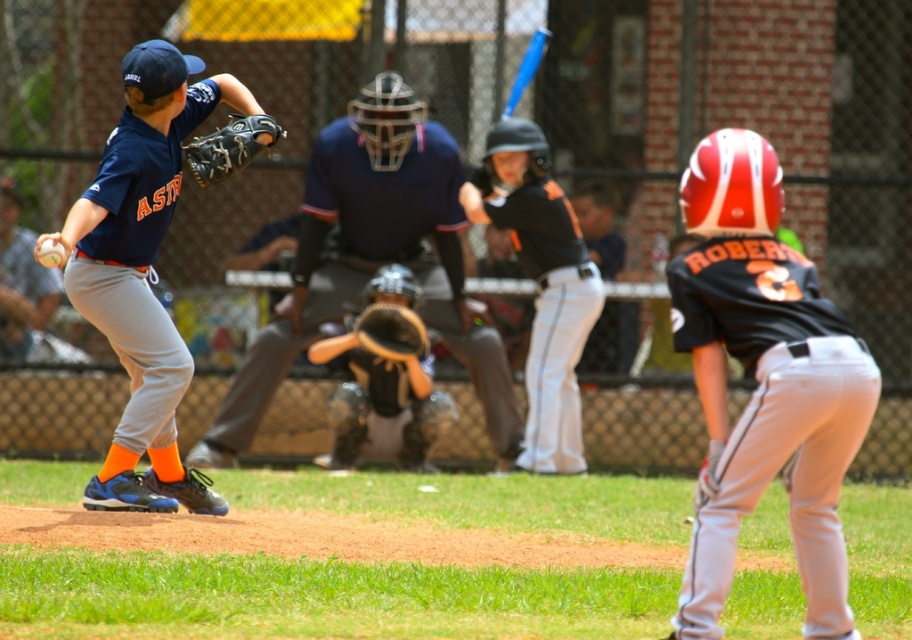
From the picture: You are a coach observing the baseball game. You notice the black matte uniform at center and the black leather glove at upper left. Which object is positioned lower in the image?

The black matte uniform at center is located below the black leather glove at upper left, so the black matte uniform at center is positioned lower in the image.

You are a coach observing the baseball game. You notice the matte black helmet at upper right and the white matte baseball at center. Which object is located to the right of the other?

The matte black helmet at upper right is positioned on the right side of the white matte baseball at center.

You are a catcher in this baseball game and you need to catch the white matte baseball at center. Where should you position your black leather glove at upper left to catch it?

The black leather glove at upper left should be positioned below the white matte baseball at center since the glove is currently above the baseball and needs to be in the path of the ball to catch it.